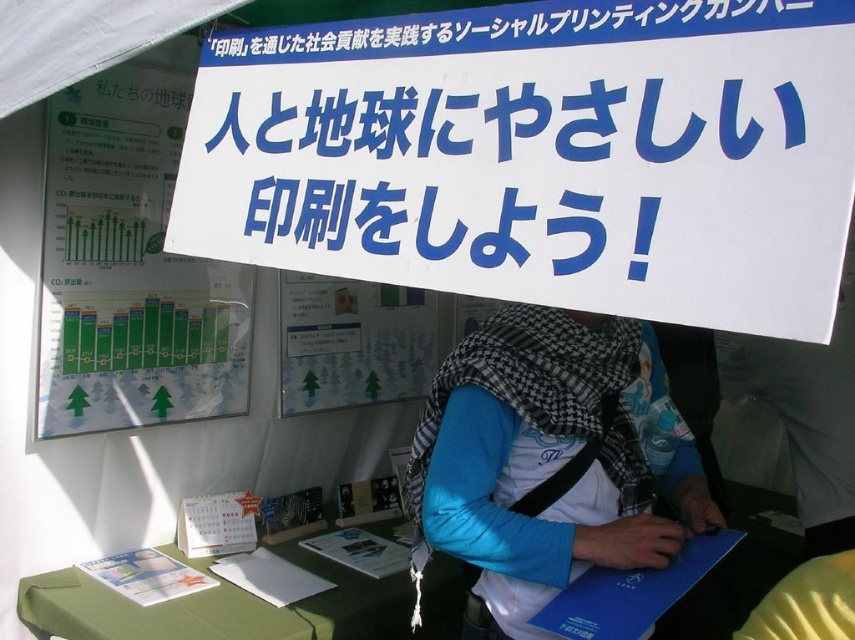
Is white paper sign at upper center smaller than blue cotton shirt at center?

No.

Can you confirm if white paper sign at upper center is positioned to the right of blue cotton shirt at center?

Incorrect, white paper sign at upper center is not on the right side of blue cotton shirt at center.

Measure the distance between point (310, 45) and camera.

Point (310, 45) is 1.07 meters away from camera.

Identify the location of white paper sign at upper center. This screenshot has width=855, height=640. (540, 156).

Which of these two, blue cotton shirt at center or green paper at left, stands shorter?

Standing shorter between the two is blue cotton shirt at center.

Between point (585, 326) and point (175, 388), which one is positioned behind?

Point (175, 388)

Identify the location of blue cotton shirt at center. This screenshot has height=640, width=855. (550, 460).

The height and width of the screenshot is (640, 855). What do you see at coordinates (540, 156) in the screenshot?
I see `white paper sign at upper center` at bounding box center [540, 156].

Who is more forward, (x=644, y=259) or (x=98, y=128)?

Point (x=644, y=259)

Locate an element on the screen. The width and height of the screenshot is (855, 640). white paper sign at upper center is located at coordinates (540, 156).